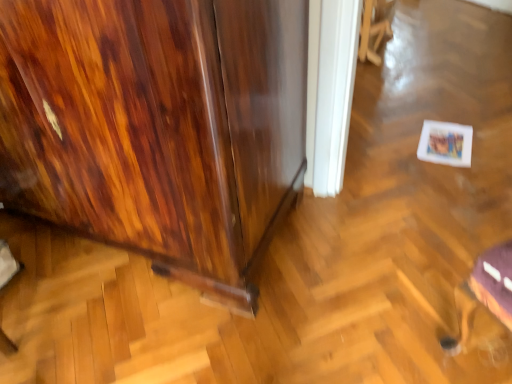
Image resolution: width=512 pixels, height=384 pixels. What are the coordinates of `vacant area situated below metallic silver swivel chair at lower right, which is the first swivel chair in bottom-to-top order (from a real-world perspective)` in the screenshot? It's located at (482, 354).